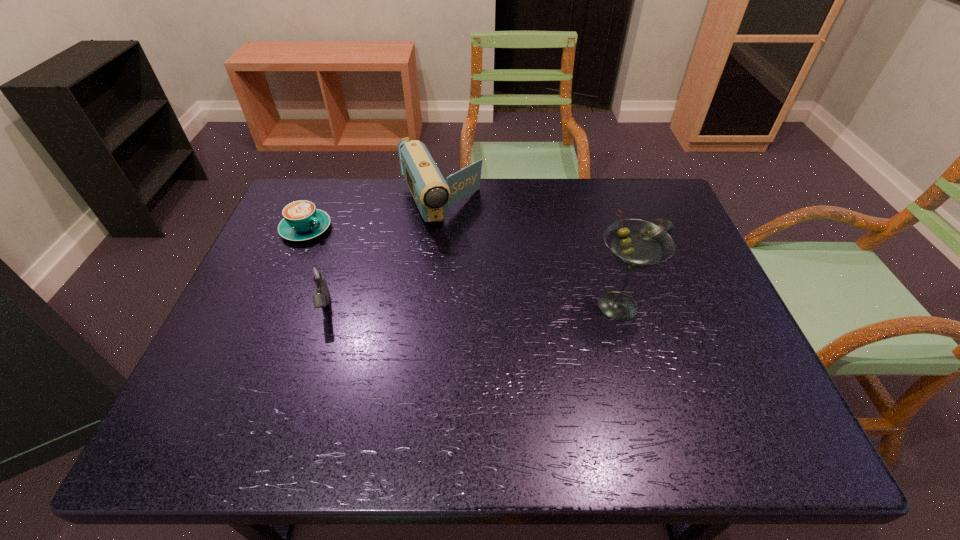
The image size is (960, 540). What are the coordinates of `free space on the desktop that is between the igniter and the martini and is positioned on the wheel side of the computer mouse` in the screenshot? It's located at (496, 306).

I want to click on free space on the desktop that is between the igniter and the martini and is positioned on the side of the camcorder with the flip-out screen, so click(492, 306).

Locate an element on the screen. vacant spot on the desktop that is between the igniter and the tallest object and is positioned with the handle on the right side of the cappuccino is located at coordinates (467, 306).